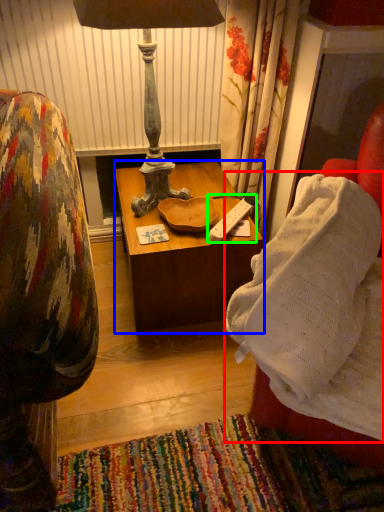
Question: Considering the real-world distances, which object is farthest from blanket (highlighted by a red box)? table (highlighted by a blue box) or remote (highlighted by a green box)?

Choices:
 (A) table
 (B) remote

Answer: (A)